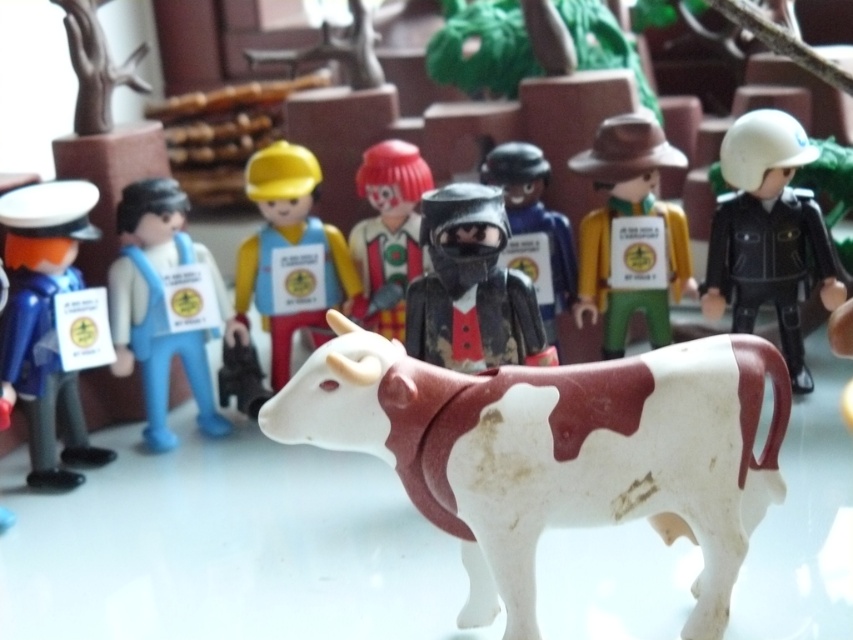
Question: Is blue plastic officer at left smaller than shiny black armor at center?

Choices:
 (A) yes
 (B) no

Answer: (B)

Question: Considering the real-world distances, which object is closest to the matte plastic construction worker at center?

Choices:
 (A) brown matte cowboy hat at center
 (B) black matte helmet at upper right

Answer: (A)

Question: Among these points, which one is nearest to the camera?

Choices:
 (A) (683, 632)
 (B) (656, 344)

Answer: (A)

Question: Does matte plastic construction worker at center appear on the left side of shiny black armor at center?

Choices:
 (A) no
 (B) yes

Answer: (B)

Question: Which of the following is the farthest from the observer?

Choices:
 (A) white matte plastic bull at center
 (B) matte plastic clown at center

Answer: (B)

Question: Is white matte plastic bull at center positioned at the back of black matte helmet at upper right?

Choices:
 (A) no
 (B) yes

Answer: (A)